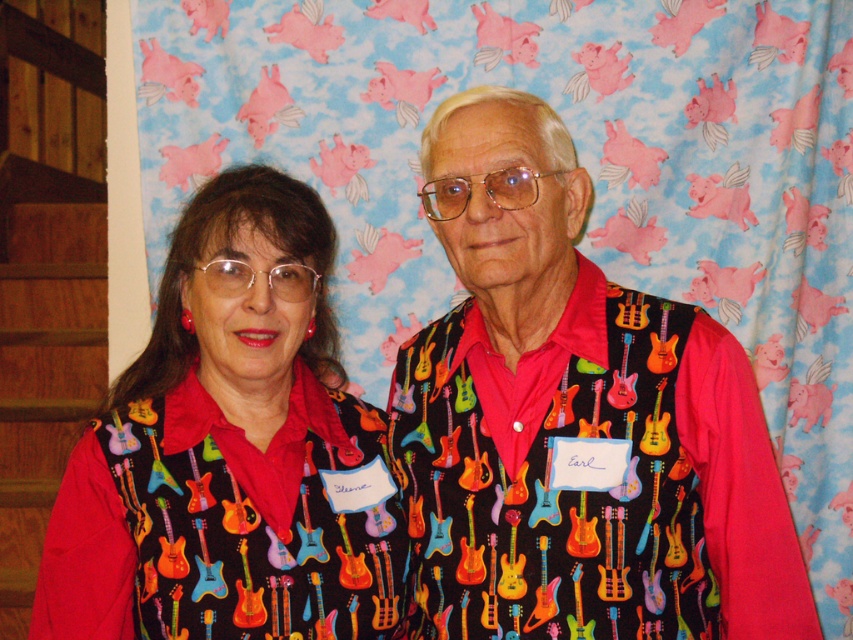
Does multicolored fabric guitar vest at center appear on the left side of matte black shirt with guitar pattern at center?

In fact, multicolored fabric guitar vest at center is to the right of matte black shirt with guitar pattern at center.

Is multicolored fabric guitar vest at center smaller than matte black shirt with guitar pattern at center?

Actually, multicolored fabric guitar vest at center might be larger than matte black shirt with guitar pattern at center.

This screenshot has height=640, width=853. Identify the location of multicolored fabric guitar vest at center. (573, 420).